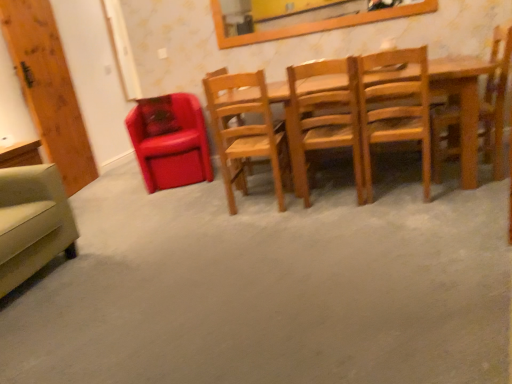
This screenshot has height=384, width=512. I want to click on wooden frame at upper center, so click(315, 24).

Locate an element on the screen. This screenshot has width=512, height=384. wooden chair at center, the fifth chair viewed from the left is located at coordinates (395, 110).

What do you see at coordinates (246, 134) in the screenshot? This screenshot has width=512, height=384. I see `wooden chair at center, arranged as the third chair when viewed from the left` at bounding box center [246, 134].

At what (x,y) coordinates should I click in order to perform the action: click on beige fabric armchair at lower left, the 1th chair positioned from the left. Please return your answer as a coordinate pair (x, y). The height and width of the screenshot is (384, 512). Looking at the image, I should click on (32, 222).

What do you see at coordinates (32, 222) in the screenshot? The width and height of the screenshot is (512, 384). I see `beige fabric armchair at lower left, the 1th chair positioned from the left` at bounding box center [32, 222].

In order to face wooden chair at center, arranged as the 3th chair when viewed from the right, should I rotate leftwards or rightwards?

A 9.632 degree turn to the right will do.

Locate an element on the screen. The width and height of the screenshot is (512, 384). wooden frame at upper center is located at coordinates (315, 24).

Which object is thinner, wooden chair at center, the fifth chair viewed from the left, or matte leather chair at left, the 5th chair viewed from the right?

wooden chair at center, the fifth chair viewed from the left, is thinner.

From the image's perspective, is wooden chair at center, marked as the 2th chair in a right-to-left arrangement, positioned above or below matte leather chair at left, the 5th chair viewed from the right?

Clearly, from the image's perspective, wooden chair at center, marked as the 2th chair in a right-to-left arrangement, is below matte leather chair at left, the 5th chair viewed from the right.

Where is `the 3rd chair below the wooden frame at upper center (from the image's perspective)`? The width and height of the screenshot is (512, 384). the 3rd chair below the wooden frame at upper center (from the image's perspective) is located at coordinates (395, 110).

Can we say wooden chair at center, the fifth chair viewed from the left, lies outside wooden frame at upper center?

Absolutely, wooden chair at center, the fifth chair viewed from the left, is external to wooden frame at upper center.

From the image's perspective, is wooden chair at center, marked as the 2th chair in a right-to-left arrangement, located beneath wooden frame at upper center?

Yes.

Is wooden chair at center, which is the fourth chair from left to right, situated inside wooden chair at right, the sixth chair positioned from the left, or outside?

wooden chair at center, which is the fourth chair from left to right, is outside wooden chair at right, the sixth chair positioned from the left.

Does wooden chair at center, arranged as the 3th chair when viewed from the right, come in front of wooden chair at right, the sixth chair positioned from the left?

Yes, wooden chair at center, arranged as the 3th chair when viewed from the right, is closer to the viewer.

Does wooden chair at center, arranged as the 3th chair when viewed from the right, have a smaller size compared to wooden chair at right, the sixth chair positioned from the left?

No, wooden chair at center, arranged as the 3th chair when viewed from the right, is not smaller than wooden chair at right, the sixth chair positioned from the left.

Is wooden chair at center, arranged as the 3th chair when viewed from the right, far from wooden chair at right, the sixth chair positioned from the left?

No, wooden chair at center, arranged as the 3th chair when viewed from the right, is not far away from wooden chair at right, the sixth chair positioned from the left.

From a real-world perspective, is wooden frame at upper center physically located above or below matte leather chair at left, marked as the second chair in a left-to-right arrangement?

wooden frame at upper center is above matte leather chair at left, marked as the second chair in a left-to-right arrangement.

Which object is positioned more to the left, wooden frame at upper center or matte leather chair at left, marked as the second chair in a left-to-right arrangement?

matte leather chair at left, marked as the second chair in a left-to-right arrangement.

In the scene shown: Is matte leather chair at left, the 5th chair viewed from the right, a part of wooden frame at upper center?

No, matte leather chair at left, the 5th chair viewed from the right, is located outside of wooden frame at upper center.

Which of these two, wooden frame at upper center or matte leather chair at left, the 5th chair viewed from the right, is thinner?

wooden frame at upper center is thinner.

In terms of size, does wooden chair at center, marked as the 2th chair in a right-to-left arrangement, appear bigger or smaller than beige fabric armchair at lower left, the 1th chair positioned from the left?

In the image, wooden chair at center, marked as the 2th chair in a right-to-left arrangement, appears to be smaller than beige fabric armchair at lower left, the 1th chair positioned from the left.

From the image's perspective, is wooden chair at center, the fifth chair viewed from the left, located above or below beige fabric armchair at lower left, placed as the 6th chair when sorted from right to left?

Clearly, from the image's perspective, wooden chair at center, the fifth chair viewed from the left, is above beige fabric armchair at lower left, placed as the 6th chair when sorted from right to left.

Considering the relative positions of wooden chair at center, marked as the 2th chair in a right-to-left arrangement, and beige fabric armchair at lower left, the 1th chair positioned from the left, in the image provided, is wooden chair at center, marked as the 2th chair in a right-to-left arrangement, to the right of beige fabric armchair at lower left, the 1th chair positioned from the left, from the viewer's perspective?

Correct, you'll find wooden chair at center, marked as the 2th chair in a right-to-left arrangement, to the right of beige fabric armchair at lower left, the 1th chair positioned from the left.

In terms of height, does wooden chair at center, marked as the 2th chair in a right-to-left arrangement, look taller or shorter compared to beige fabric armchair at lower left, the 1th chair positioned from the left?

In the image, wooden chair at center, marked as the 2th chair in a right-to-left arrangement, appears to be taller than beige fabric armchair at lower left, the 1th chair positioned from the left.

In the scene shown: Would you say wooden chair at center, arranged as the 3th chair when viewed from the right, is inside or outside wooden chair at center, arranged as the third chair when viewed from the left?

wooden chair at center, arranged as the 3th chair when viewed from the right, lies outside wooden chair at center, arranged as the third chair when viewed from the left.

Does wooden chair at center, arranged as the 3th chair when viewed from the right, turn towards wooden chair at center, arranged as the third chair when viewed from the left?

No, wooden chair at center, arranged as the 3th chair when viewed from the right, is not turned towards wooden chair at center, arranged as the third chair when viewed from the left.

Is wooden chair at center, arranged as the 3th chair when viewed from the right, next to wooden chair at center, arranged as the third chair when viewed from the left, and touching it?

wooden chair at center, arranged as the 3th chair when viewed from the right, and wooden chair at center, arranged as the third chair when viewed from the left, are not in contact.

Considering the relative sizes of wooden chair at center, arranged as the 3th chair when viewed from the right, and wooden chair at center, marked as the fourth chair in a right-to-left arrangement, in the image provided, is wooden chair at center, arranged as the 3th chair when viewed from the right, wider than wooden chair at center, marked as the fourth chair in a right-to-left arrangement,?

Yes.

Is beige fabric armchair at lower left, the 1th chair positioned from the left, further to the viewer compared to wooden chair at center, arranged as the third chair when viewed from the left?

That is False.

Between beige fabric armchair at lower left, the 1th chair positioned from the left, and wooden chair at center, arranged as the third chair when viewed from the left, which one has less height?

Standing shorter between the two is beige fabric armchair at lower left, the 1th chair positioned from the left.

Looking at this image, from the image's perspective, is beige fabric armchair at lower left, placed as the 6th chair when sorted from right to left, positioned above or below wooden chair at center, arranged as the third chair when viewed from the left?

Based on their image positions, beige fabric armchair at lower left, placed as the 6th chair when sorted from right to left, is located beneath wooden chair at center, arranged as the third chair when viewed from the left.

Does point (9, 233) come behind point (280, 126)?

No, (9, 233) is closer to viewer.

I want to click on chair that is the 2nd object above the matte leather chair at left, the 5th chair viewed from the right (from a real-world perspective), so click(395, 110).

From the image's perspective, count 3rd chairs downward from the wooden frame at upper center and point to it. Please provide its 2D coordinates.

[(395, 110)]

Consider the image. When comparing their distances from wooden chair at center, marked as the 2th chair in a right-to-left arrangement, does wooden chair at center, marked as the fourth chair in a right-to-left arrangement, or beige fabric armchair at lower left, the 1th chair positioned from the left, seem closer?

Based on the image, wooden chair at center, marked as the fourth chair in a right-to-left arrangement, appears to be nearer to wooden chair at center, marked as the 2th chair in a right-to-left arrangement.

Considering their positions, is wooden chair at center, marked as the fourth chair in a right-to-left arrangement, positioned further to wooden chair at center, marked as the 2th chair in a right-to-left arrangement, than wooden chair at center, which is the fourth chair from left to right?

Based on the image, wooden chair at center, marked as the fourth chair in a right-to-left arrangement, appears to be further to wooden chair at center, marked as the 2th chair in a right-to-left arrangement.

Based on the photo, considering their positions, is wooden chair at right, which is the 1th chair in right-to-left order, positioned further to wooden frame at upper center than wooden chair at center, which is the fourth chair from left to right?

Among the two, wooden chair at center, which is the fourth chair from left to right, is located further to wooden frame at upper center.

From the image, which object appears to be nearer to wooden chair at center, which is the fourth chair from left to right, wooden chair at right, which is the 1th chair in right-to-left order, or wooden chair at center, arranged as the third chair when viewed from the left?

wooden chair at center, arranged as the third chair when viewed from the left, is closer to wooden chair at center, which is the fourth chair from left to right.

Considering their positions, is wooden chair at right, the sixth chair positioned from the left, positioned further to wooden chair at center, marked as the 2th chair in a right-to-left arrangement, than wooden chair at center, which is the fourth chair from left to right?

wooden chair at right, the sixth chair positioned from the left, lies further to wooden chair at center, marked as the 2th chair in a right-to-left arrangement, than the other object.

Estimate the real-world distances between objects in this image. Which object is closer to beige fabric armchair at lower left, placed as the 6th chair when sorted from right to left, wooden chair at center, the fifth chair viewed from the left, or wooden chair at center, marked as the fourth chair in a right-to-left arrangement?

wooden chair at center, marked as the fourth chair in a right-to-left arrangement, lies closer to beige fabric armchair at lower left, placed as the 6th chair when sorted from right to left, than the other object.

Considering their positions, is wooden frame at upper center positioned further to wooden chair at center, which is the fourth chair from left to right, than wooden chair at center, the fifth chair viewed from the left?

wooden frame at upper center lies further to wooden chair at center, which is the fourth chair from left to right, than the other object.

Looking at the image, which one is located further to beige fabric armchair at lower left, placed as the 6th chair when sorted from right to left, wooden chair at center, which is the fourth chair from left to right, or wooden chair at right, the sixth chair positioned from the left?

Based on the image, wooden chair at right, the sixth chair positioned from the left, appears to be further to beige fabric armchair at lower left, placed as the 6th chair when sorted from right to left.

Find the location of `mirror located between matte leather chair at left, marked as the second chair in a left-to-right arrangement, and wooden chair at center, the fifth chair viewed from the left, in the left-right direction`. mirror located between matte leather chair at left, marked as the second chair in a left-to-right arrangement, and wooden chair at center, the fifth chair viewed from the left, in the left-right direction is located at coordinates (315, 24).

I want to click on chair between matte leather chair at left, marked as the second chair in a left-to-right arrangement, and wooden chair at center, which is the fourth chair from left to right, in the horizontal direction, so click(x=246, y=134).

Where is `chair between wooden chair at center, which is the fourth chair from left to right, and wooden chair at right, which is the 1th chair in right-to-left order`? chair between wooden chair at center, which is the fourth chair from left to right, and wooden chair at right, which is the 1th chair in right-to-left order is located at coordinates (395, 110).

Identify the location of mirror located between wooden chair at center, marked as the fourth chair in a right-to-left arrangement, and wooden chair at right, the sixth chair positioned from the left, in the left-right direction. (315, 24).